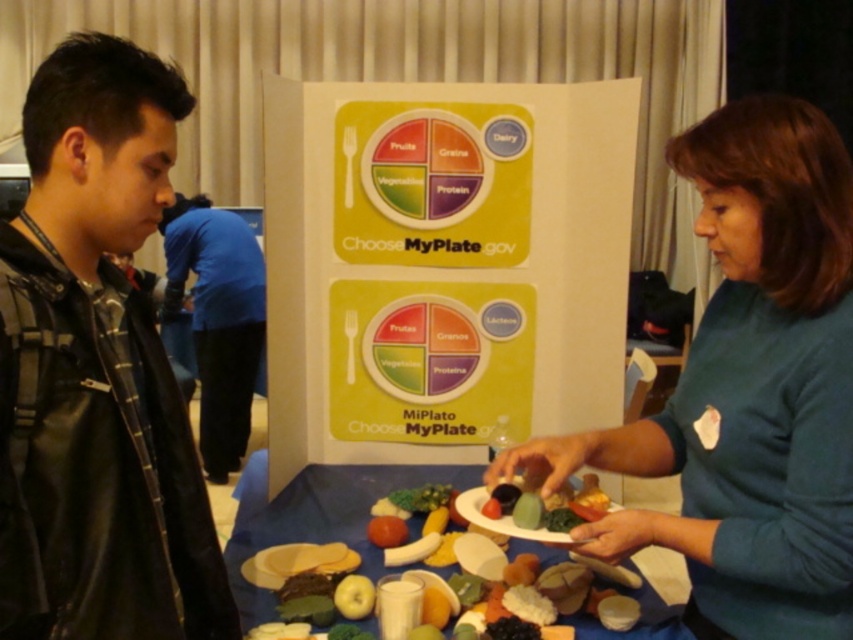
Who is higher up, black leather jacket at left or teal fabric shirt at center?

black leather jacket at left

Does black leather jacket at left have a lesser height compared to teal fabric shirt at center?

Yes.

Who is more forward, (61,250) or (740,433)?

Point (61,250) is in front.

At what (x,y) coordinates should I click in order to perform the action: click on black leather jacket at left. Please return your answer as a coordinate pair (x, y). The width and height of the screenshot is (853, 640). Looking at the image, I should click on (97, 371).

Is blue fabric pants at left further to camera compared to plastic food model at center?

Yes, blue fabric pants at left is further from the viewer.

Between point (207, 321) and point (315, 531), which one is positioned behind?

Positioned behind is point (207, 321).

Does point (202, 324) lie in front of point (241, 582)?

That is False.

Identify the location of blue fabric pants at left. (218, 320).

Between teal fabric shirt at center and plastic food model at center, which one is positioned higher?

teal fabric shirt at center is higher up.

Can you confirm if teal fabric shirt at center is shorter than plastic food model at center?

In fact, teal fabric shirt at center may be taller than plastic food model at center.

In order to click on teal fabric shirt at center in this screenshot , I will do `click(747, 392)`.